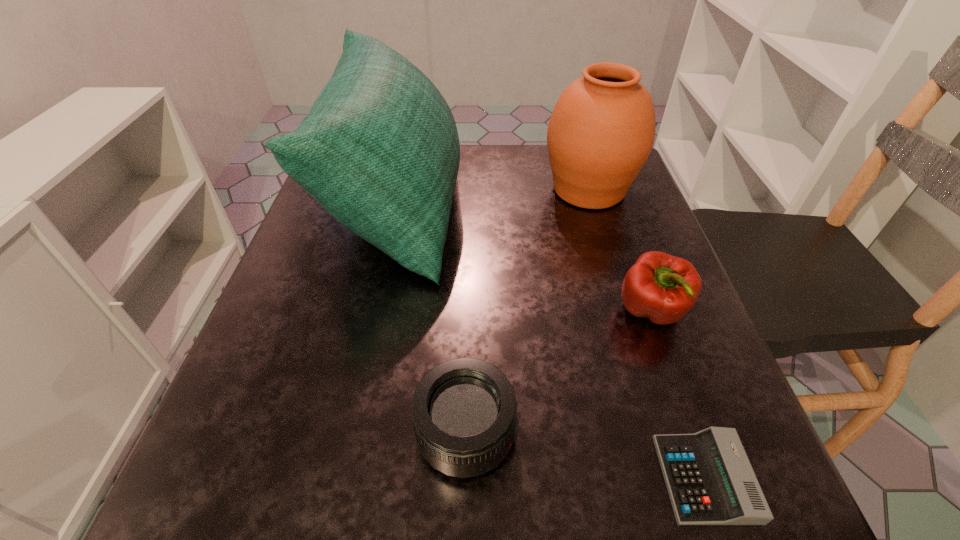
This screenshot has height=540, width=960. I want to click on vacant position in the image that satisfies the following two spatial constraints: 1. on the back side of the calculator; 2. on the front-facing side of the cushion, so click(x=609, y=204).

Where is `free location that satisfies the following two spatial constraints: 1. on the front-facing side of the cushion; 2. on the right side of the third shortest object`? Image resolution: width=960 pixels, height=540 pixels. free location that satisfies the following two spatial constraints: 1. on the front-facing side of the cushion; 2. on the right side of the third shortest object is located at coordinates (372, 312).

This screenshot has width=960, height=540. What are the coordinates of `free point that satisfies the following two spatial constraints: 1. on the front-facing side of the shortest object; 2. on the right side of the cushion` in the screenshot? It's located at (335, 478).

Where is `vacant space that satisfies the following two spatial constraints: 1. on the front-facing side of the calculator; 2. on the right side of the cushion`? The width and height of the screenshot is (960, 540). vacant space that satisfies the following two spatial constraints: 1. on the front-facing side of the calculator; 2. on the right side of the cushion is located at coordinates (335, 478).

The width and height of the screenshot is (960, 540). I want to click on free space that satisfies the following two spatial constraints: 1. on the back side of the shortest object; 2. on the front-facing side of the cushion, so click(x=609, y=204).

Locate an element on the screen. The image size is (960, 540). vacant area that satisfies the following two spatial constraints: 1. on the side of the telephoto lens with brand markings and control switches; 2. on the right side of the calculator is located at coordinates (467, 478).

Where is `vacant region that satisfies the following two spatial constraints: 1. on the side of the second shortest object with brand markings and control switches; 2. on the right side of the shortest object`? The image size is (960, 540). vacant region that satisfies the following two spatial constraints: 1. on the side of the second shortest object with brand markings and control switches; 2. on the right side of the shortest object is located at coordinates pos(467,478).